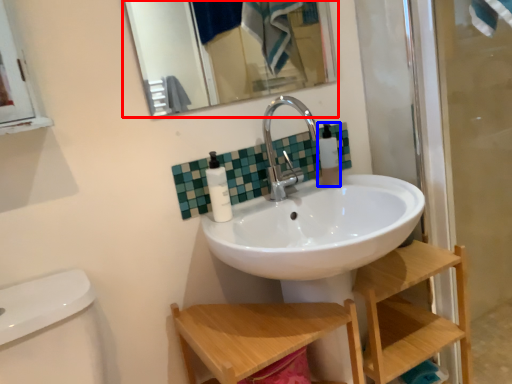
Question: Which of the following is the farthest to the observer, mirror (highlighted by a red box) or toiletry (highlighted by a blue box)?

Choices:
 (A) mirror
 (B) toiletry

Answer: (B)